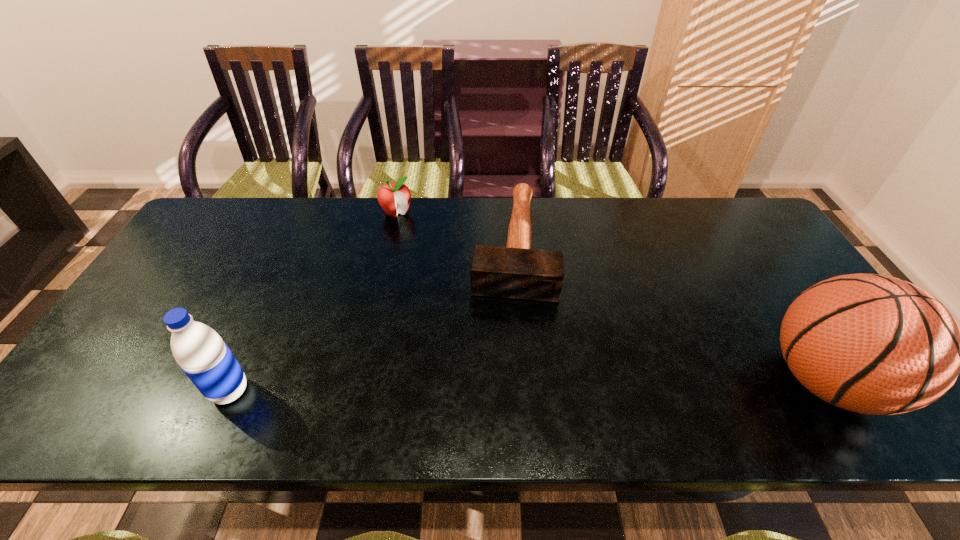
This screenshot has height=540, width=960. In order to click on vacant area located on the side where a bite is taken out of the third tallest object in this screenshot , I will do `click(428, 258)`.

Where is `free spot located 0.160m on the side where a bite is taken out of the third tallest object`? free spot located 0.160m on the side where a bite is taken out of the third tallest object is located at coordinates (422, 250).

Identify the location of vacant space positioned on the side where a bite is taken out of the third tallest object. click(422, 250).

You are a GUI agent. You are given a task and a screenshot of the screen. Output one action in this format:
    pyautogui.click(x=<x>, y=<y>)
    Task: Click on the mallet that is at the far edge
    The height and width of the screenshot is (540, 960).
    Given the screenshot: What is the action you would take?
    pyautogui.click(x=516, y=271)

Locate an element on the screen. The width and height of the screenshot is (960, 540). apple at the far edge is located at coordinates (394, 197).

Image resolution: width=960 pixels, height=540 pixels. I want to click on water bottle present at the near edge, so click(x=204, y=357).

Where is `basketball that is at the near edge`? This screenshot has width=960, height=540. basketball that is at the near edge is located at coordinates (873, 344).

At what (x,y) coordinates should I click in order to perform the action: click on object present at the right edge. Please return your answer as a coordinate pair (x, y). This screenshot has width=960, height=540. Looking at the image, I should click on (873, 344).

This screenshot has width=960, height=540. Identify the location of object that is at the near right corner. (873, 344).

The height and width of the screenshot is (540, 960). In order to click on vacant area at the far edge in this screenshot , I will do pyautogui.click(x=560, y=201).